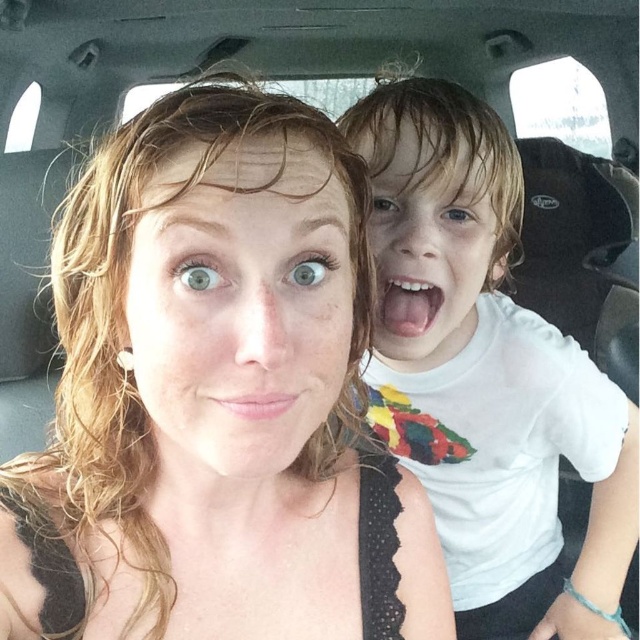
Which is below, white cotton shirt at right or pink smooth lips at center?

Positioned lower is white cotton shirt at right.

Is white cotton shirt at right wider than pink smooth lips at center?

Indeed, white cotton shirt at right has a greater width compared to pink smooth lips at center.

The image size is (640, 640). I want to click on white cotton shirt at right, so click(488, 374).

Is point (436, 589) more distant than point (266, 410)?

Yes, it is behind point (266, 410).

Is matte black tank top at center further to camera compared to pink smooth lips at center?

No, it is not.

Which is behind, point (221, 369) or point (273, 410)?

The point (273, 410) is behind.

You are a GUI agent. You are given a task and a screenshot of the screen. Output one action in this format:
    pyautogui.click(x=<x>, y=<y>)
    Task: Click on the matte black tank top at center
    The width and height of the screenshot is (640, 640).
    Given the screenshot: What is the action you would take?
    pyautogui.click(x=216, y=396)

Who is taller, natural skin tone at center or pink smooth lips at center?

Standing taller between the two is natural skin tone at center.

Based on the photo, which is above, natural skin tone at center or pink smooth lips at center?

natural skin tone at center is higher up.

Identify the location of natural skin tone at center. The width and height of the screenshot is (640, 640). (241, 301).